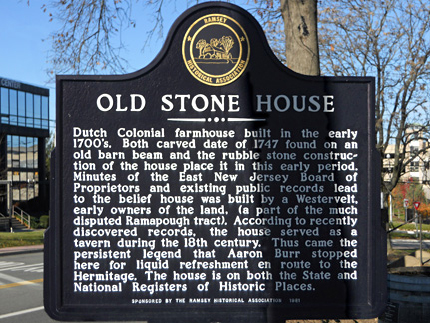
This screenshot has width=430, height=323. I want to click on windows, so click(x=35, y=109), click(x=19, y=107), click(x=26, y=150), click(x=11, y=149), click(x=3, y=101).